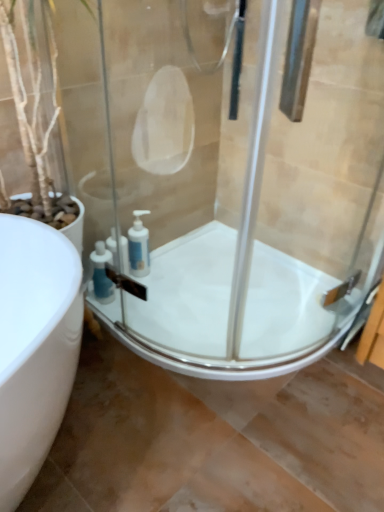
This screenshot has width=384, height=512. Find the location of `space that is in front of white glossy bath at center`. space that is in front of white glossy bath at center is located at coordinates (218, 439).